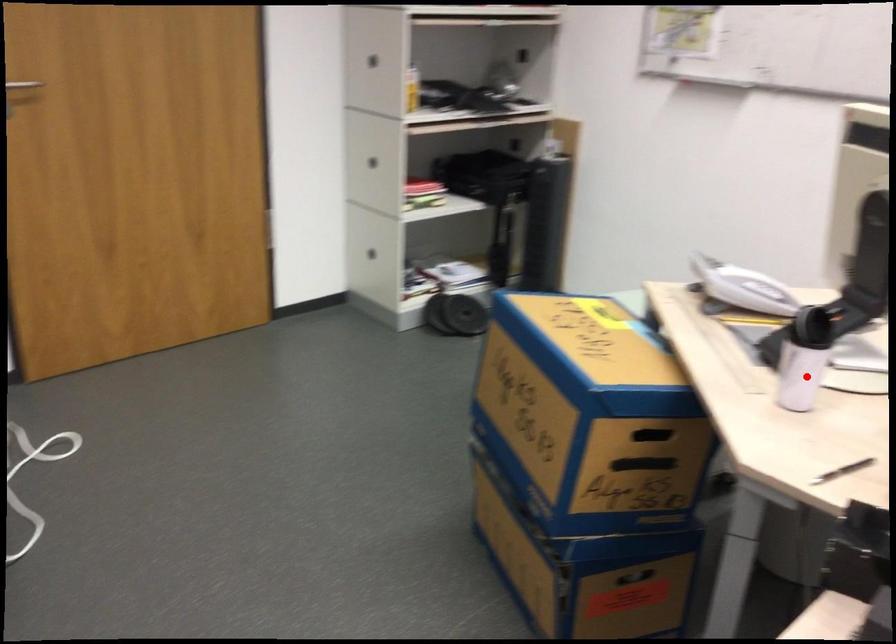
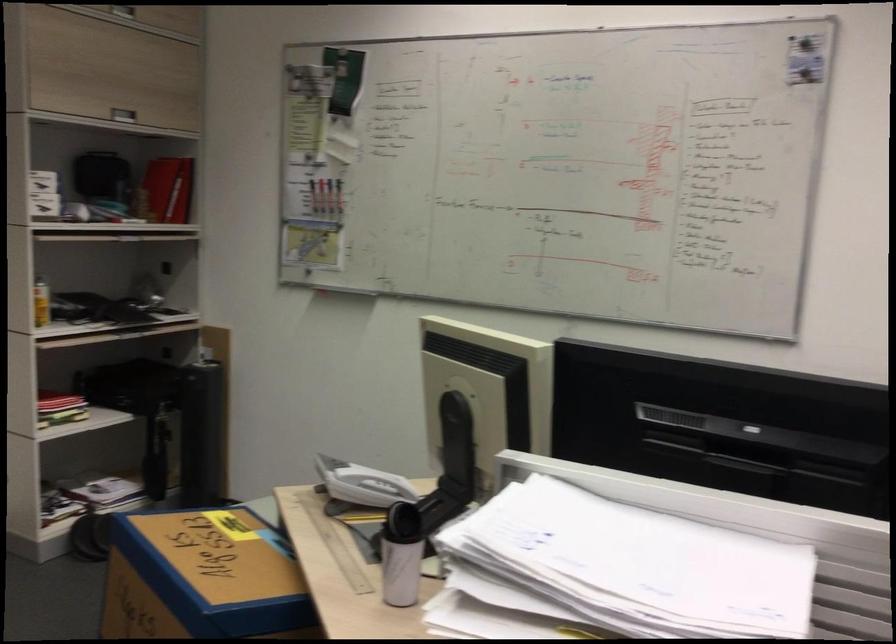
The point at the highlighted location is marked in the first image. Where is the corresponding point in the second image?

(400, 570)